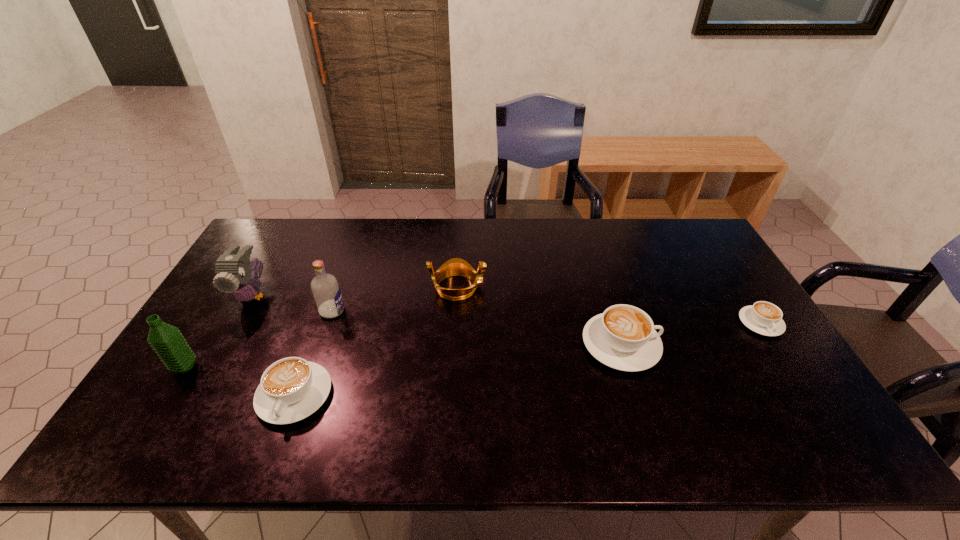
Locate an element on the screen. vacant point at the near edge is located at coordinates (577, 396).

Find the location of a particular element. The width and height of the screenshot is (960, 540). blank space at the right edge of the desktop is located at coordinates (698, 294).

Locate an element on the screen. Image resolution: width=960 pixels, height=540 pixels. vacant area between the shortest object and the second object from left to right is located at coordinates (507, 309).

Image resolution: width=960 pixels, height=540 pixels. I want to click on free space between the vodka and the second cappuccino from right to left, so click(476, 328).

Identify the location of blank region between the bird and the vodka. Image resolution: width=960 pixels, height=540 pixels. pyautogui.click(x=293, y=303).

This screenshot has width=960, height=540. I want to click on free space between the sixth object from right to left and the leftmost cappuccino, so click(x=274, y=345).

At what (x,y) coordinates should I click in order to perform the action: click on empty space that is in between the shortest object and the second shortest object. Please return your answer as a coordinate pair (x, y). This screenshot has width=960, height=540. Looking at the image, I should click on (528, 359).

Identify the location of free spot between the vodka and the second object from left to right. The image size is (960, 540). (293, 303).

This screenshot has width=960, height=540. Identify the location of vacant point located between the bird and the second cappuccino from left to right. (437, 320).

The image size is (960, 540). Find the location of `vacant area between the vodka and the shortest cappuccino`. vacant area between the vodka and the shortest cappuccino is located at coordinates tap(546, 317).